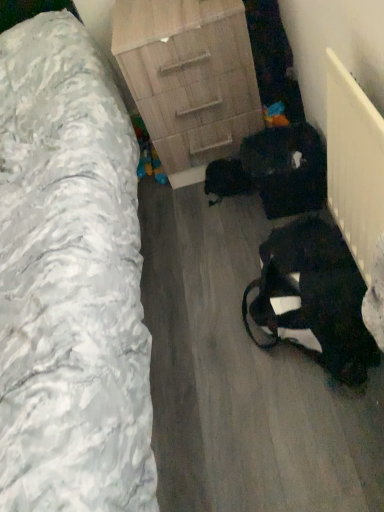
You are a GUI agent. You are given a task and a screenshot of the screen. Output one action in this format:
    pyautogui.click(x=<x>, y=<y>)
    Task: Click on the black fabric bag at lower right
    The height and width of the screenshot is (512, 384).
    Given the screenshot: What is the action you would take?
    pyautogui.click(x=314, y=297)

Where is `wooden chest of drawers at center`? wooden chest of drawers at center is located at coordinates (189, 78).

What is the approximate width of wooden chest of drawers at center?

21.77 inches.

The image size is (384, 512). I want to click on wooden nightstand at center, so click(x=70, y=281).

From a real-world perspective, does black fabric bag at lower right sit lower than wooden chest of drawers at center?

Yes, from a real-world perspective, black fabric bag at lower right is beneath wooden chest of drawers at center.

Can you confirm if black fabric bag at lower right is positioned to the right of wooden chest of drawers at center?

Yes, black fabric bag at lower right is to the right of wooden chest of drawers at center.

How much distance is there between black fabric bag at lower right and wooden chest of drawers at center?

A distance of 28.00 inches exists between black fabric bag at lower right and wooden chest of drawers at center.

From the image's perspective, which one is positioned lower, black fabric bag at lower right or wooden chest of drawers at center?

black fabric bag at lower right appears lower in the image.

Could you tell me if black fabric bag at lower right is facing wooden nightstand at center?

Yes, black fabric bag at lower right is oriented towards wooden nightstand at center.

In the image, is black fabric bag at lower right on the left side or the right side of wooden nightstand at center?

In the image, black fabric bag at lower right appears on the right side of wooden nightstand at center.

Considering the relative sizes of black fabric bag at lower right and wooden nightstand at center in the image provided, is black fabric bag at lower right taller than wooden nightstand at center?

In fact, black fabric bag at lower right may be shorter than wooden nightstand at center.

Is wooden chest of drawers at center aimed at black fabric bag at lower right?

Yes, wooden chest of drawers at center is oriented towards black fabric bag at lower right.

Can you confirm if wooden chest of drawers at center is thinner than black fabric bag at lower right?

No.

Where is `chest of drawers behind the black fabric bag at lower right`? The image size is (384, 512). chest of drawers behind the black fabric bag at lower right is located at coordinates (189, 78).

Considering the positions of objects wooden chest of drawers at center and black fabric bag at lower right in the image provided, who is more to the right, wooden chest of drawers at center or black fabric bag at lower right?

Positioned to the right is black fabric bag at lower right.

Identify the location of chest of drawers on the right of wooden nightstand at center. (189, 78).

How distant is wooden nightstand at center from wooden chest of drawers at center?

wooden nightstand at center is 17.94 inches from wooden chest of drawers at center.

From the picture: Which of these two, wooden nightstand at center or wooden chest of drawers at center, stands shorter?

Standing shorter between the two is wooden chest of drawers at center.

From the image's perspective, is wooden nightstand at center located beneath wooden chest of drawers at center?

Indeed, from the image's perspective, wooden nightstand at center is shown beneath wooden chest of drawers at center.

Looking at their sizes, would you say wooden chest of drawers at center is wider or thinner than wooden nightstand at center?

Considering their sizes, wooden chest of drawers at center looks slimmer than wooden nightstand at center.

Is wooden chest of drawers at center touching wooden nightstand at center?

wooden chest of drawers at center and wooden nightstand at center are clearly separated.

Is wooden nightstand at center outside of black fabric bag at lower right?

Yes.

Could you tell me if wooden nightstand at center is turned towards black fabric bag at lower right?

No, wooden nightstand at center is not facing towards black fabric bag at lower right.

Does point (60, 150) appear closer or farther from the camera than point (258, 281)?

Point (60, 150) is positioned closer to the camera compared to point (258, 281).

Considering the relative sizes of wooden nightstand at center and black fabric bag at lower right in the image provided, is wooden nightstand at center taller than black fabric bag at lower right?

Indeed, wooden nightstand at center has a greater height compared to black fabric bag at lower right.

Where is `chest of drawers on the left of black fabric bag at lower right`? chest of drawers on the left of black fabric bag at lower right is located at coordinates (189, 78).

Find the location of `animal that is on the right side of wooden nightstand at center`. animal that is on the right side of wooden nightstand at center is located at coordinates (314, 297).

When comparing their distances from black fabric bag at lower right, does wooden chest of drawers at center or wooden nightstand at center seem further?

wooden chest of drawers at center is further to black fabric bag at lower right.

When comparing their distances from black fabric bag at lower right, does wooden nightstand at center or wooden chest of drawers at center seem closer?

wooden nightstand at center lies closer to black fabric bag at lower right than the other object.

From the image, which object appears to be farther from wooden nightstand at center, black fabric bag at lower right or wooden chest of drawers at center?

black fabric bag at lower right.

Considering their positions, is wooden chest of drawers at center positioned closer to wooden nightstand at center than black fabric bag at lower right?

wooden chest of drawers at center.

Which object lies nearer to the anchor point wooden chest of drawers at center, wooden nightstand at center or black fabric bag at lower right?

wooden nightstand at center is positioned closer to the anchor wooden chest of drawers at center.

Estimate the real-world distances between objects in this image. Which object is further from wooden chest of drawers at center, black fabric bag at lower right or wooden nightstand at center?

black fabric bag at lower right lies further to wooden chest of drawers at center than the other object.

Locate an element on the screen. This screenshot has width=384, height=512. chest of drawers between wooden nightstand at center and black fabric bag at lower right from left to right is located at coordinates (189, 78).